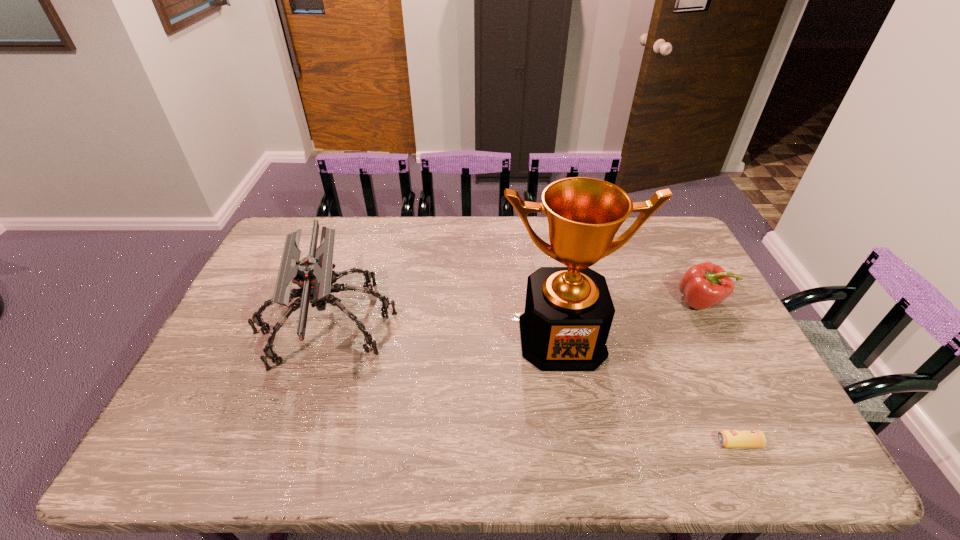
At what (x,y) coordinates should I click in order to perform the action: click on the tallest object. Please return your answer as a coordinate pair (x, y). Looking at the image, I should click on (569, 311).

The height and width of the screenshot is (540, 960). I want to click on the third object from right to left, so (x=569, y=311).

The height and width of the screenshot is (540, 960). What are the coordinates of `drone` in the screenshot? It's located at (313, 274).

You are a GUI agent. You are given a task and a screenshot of the screen. Output one action in this format:
    pyautogui.click(x=<x>, y=<y>)
    Task: Click on the second tallest object
    Image resolution: width=960 pixels, height=540 pixels.
    Given the screenshot: What is the action you would take?
    pyautogui.click(x=313, y=274)

You are a GUI agent. You are given a task and a screenshot of the screen. Output one action in this format:
    pyautogui.click(x=<x>, y=<y>)
    Task: Click on the second shortest object
    
    Given the screenshot: What is the action you would take?
    pyautogui.click(x=704, y=285)

This screenshot has height=540, width=960. I want to click on the nearest object, so click(727, 438).

Locate an element on the screen. The width and height of the screenshot is (960, 540). the shortest object is located at coordinates (727, 438).

I want to click on free space located on the front of the trophy cup with the label, so click(x=572, y=394).

Find the location of a particular element. Image resolution: width=960 pixels, height=540 pixels. free region located 0.080m on the left of the leftmost object is located at coordinates (230, 323).

The width and height of the screenshot is (960, 540). Identify the location of free space located 0.400m on the back of the pepper. (655, 216).